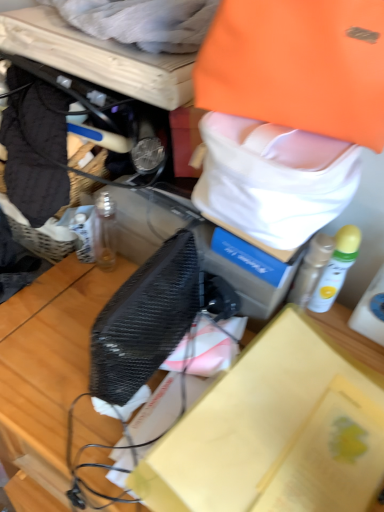
Question: Considering their positions, is orange fabric tote bag at upper right located in front of or behind black mesh box at center?

Choices:
 (A) behind
 (B) front

Answer: (A)

Question: Considering the relative positions of orange fabric tote bag at upper right and black mesh box at center in the image provided, is orange fabric tote bag at upper right to the left or to the right of black mesh box at center?

Choices:
 (A) right
 (B) left

Answer: (A)

Question: Which of these objects is positioned farthest from the black mesh box at center?

Choices:
 (A) white matte spray can at right, the 1th bottle in the right-to-left sequence
 (B) orange fabric tote bag at upper right
 (C) white cotton towel at upper center, which ranks as the 1th clothing in left-to-right order
 (D) orange fabric bag at upper center, which appears as the second clothing when viewed from the top
 (E) white matte bottle at upper right, the second bottle when ordered from right to left

Answer: (C)

Question: Considering the real-world distances, which object is farthest from the black mesh box at center?

Choices:
 (A) orange fabric tote bag at upper right
 (B) orange fabric bag at upper center, the first clothing viewed from the right
 (C) white cotton towel at upper center, which is counted as the 2th clothing, starting from the bottom
 (D) white matte bottle at upper right, which ranks as the 1th bottle in left-to-right order
 (E) white matte spray can at right, the 2th bottle when ordered from left to right

Answer: (C)